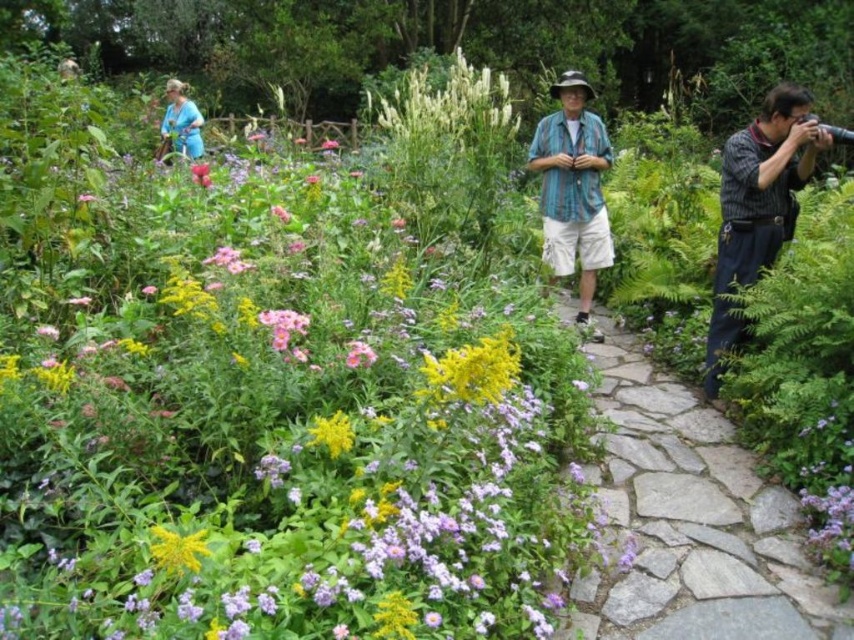
Is blue plaid shirt at center above white fluffy plant at center?

No, blue plaid shirt at center is not above white fluffy plant at center.

Does blue plaid shirt at center come behind white fluffy plant at center?

No.

Find the location of `blue plaid shirt at center`. blue plaid shirt at center is located at coordinates (572, 186).

Locate an element on the screen. blue plaid shirt at center is located at coordinates (572, 186).

Is striped shirt at right to the right of yellow matte flower at center-left from the viewer's perspective?

Yes, striped shirt at right is to the right of yellow matte flower at center-left.

Between striped shirt at right and yellow matte flower at center-left, which one appears on the left side from the viewer's perspective?

Positioned to the left is yellow matte flower at center-left.

Which is behind, point (781, 115) or point (180, 544)?

Positioned behind is point (781, 115).

Find the location of `striped shirt at right`. striped shirt at right is located at coordinates coord(757,205).

Who is more distant from viewer, (779,177) or (465,76)?

Point (465,76)

Who is positioned more to the right, striped shirt at right or white fluffy plant at center?

striped shirt at right is more to the right.

What are the coordinates of `striped shirt at right` in the screenshot? It's located at (757, 205).